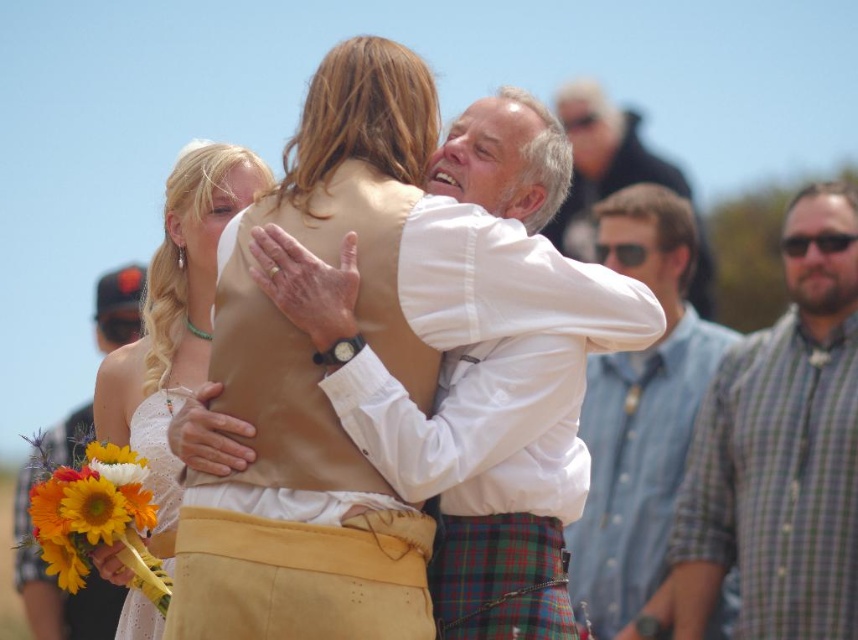
You are standing in front of the wedding scene and want to place a small decoration between the two points marked as point (122, 460) and point (86, 508). Which point is closer to you so you can place the decoration there?

Point (122, 460) is further to the viewer than point (86, 508), so the closer point to you is point (86, 508). You should place the decoration near point (86, 508).

Based on the scene description, can you determine which clothing item is positioned higher on the person wearing them? The plaid wool kilt at center or the matte khaki vest at center?

The plaid wool kilt at center is positioned higher than the matte khaki vest at center.

You are a photographer trying to capture the perfect shot of the two people in the wedding scene. You notice two points marked in the image. Which of these points, point 1 at coordinates point (418,564) or point 2 at coordinates point (28,576), is closer to you as the photographer?

Point 1 at coordinates point (418,564) is closer to the viewer than point 2 at coordinates point (28,576).